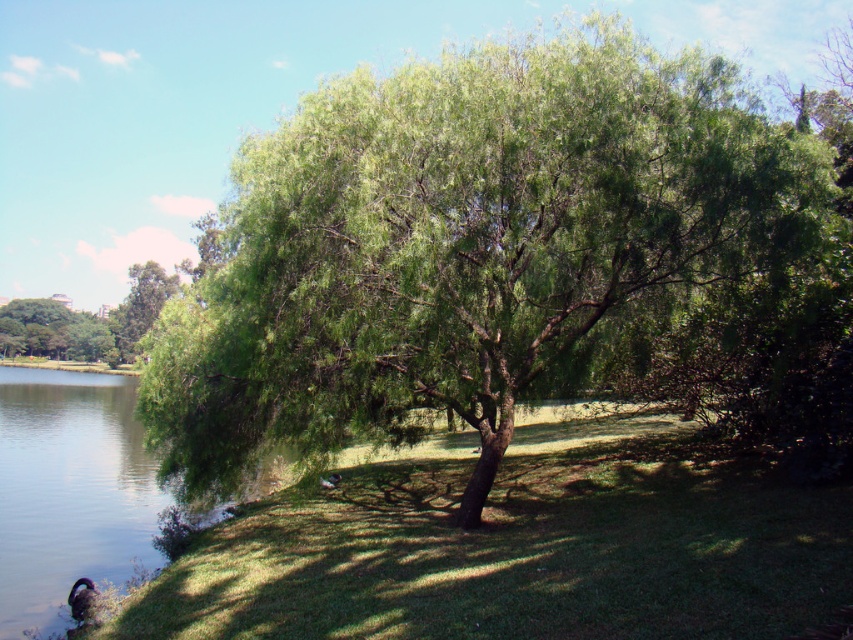
Question: Which object appears closest to the camera in this image?

Choices:
 (A) green grass at center
 (B) clear water at lower left

Answer: (A)

Question: Based on their relative distances, which object is nearer to the green leafy tree at upper left?

Choices:
 (A) clear water at lower left
 (B) green leafy tree at center
 (C) green grass at center

Answer: (A)

Question: Does green grass at center appear over clear water at lower left?

Choices:
 (A) yes
 (B) no

Answer: (A)

Question: Is green leafy tree at center positioned in front of green leafy tree at upper left?

Choices:
 (A) yes
 (B) no

Answer: (A)

Question: Which object appears farthest from the camera in this image?

Choices:
 (A) green leafy tree at center
 (B) green leafy tree at upper left
 (C) green grass at center
 (D) clear water at lower left

Answer: (B)

Question: Is green leafy tree at center positioned at the back of green grass at center?

Choices:
 (A) no
 (B) yes

Answer: (B)